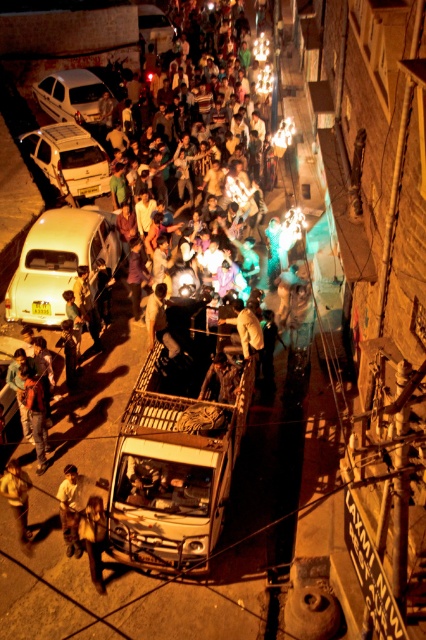
Based on the photo, you are a pedestrian standing at the edge of the street. You see the matte white sedan at upper left and the dark brown leather jacket at center. Which object is closer to you?

The dark brown leather jacket at center is closer to you because the matte white sedan at upper left is positioned over it, indicating it is further away.

You are a pedestrian standing at the center of the street. You see the matte white car at lower left and the metallic silver car at upper left. Which car is closer to you?

The matte white car at lower left is closer to you since it is 16.44 meters away from the metallic silver car at upper left, meaning the matte white car is nearer than the metallic silver car.